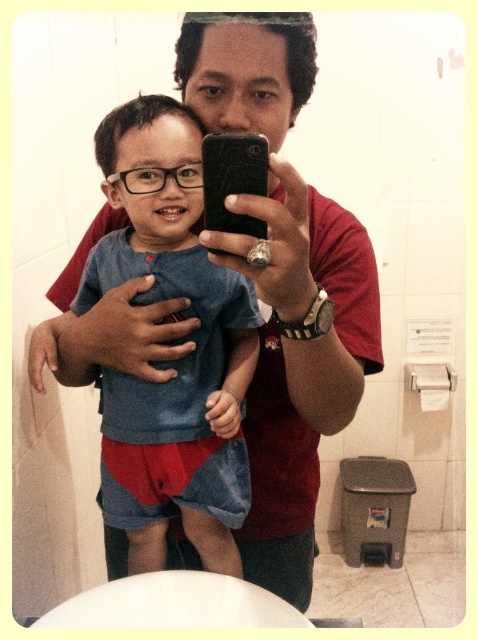
Question: Is blue denim shorts at center smaller than black matte smartphone at center?

Choices:
 (A) yes
 (B) no

Answer: (B)

Question: In this image, where is blue denim shorts at center located relative to black matte smartphone at center?

Choices:
 (A) above
 (B) below

Answer: (B)

Question: Can you confirm if blue denim shorts at center is bigger than black matte smartphone at center?

Choices:
 (A) yes
 (B) no

Answer: (A)

Question: Which point is farther to the camera?

Choices:
 (A) black matte smartphone at center
 (B) blue denim shorts at center

Answer: (B)